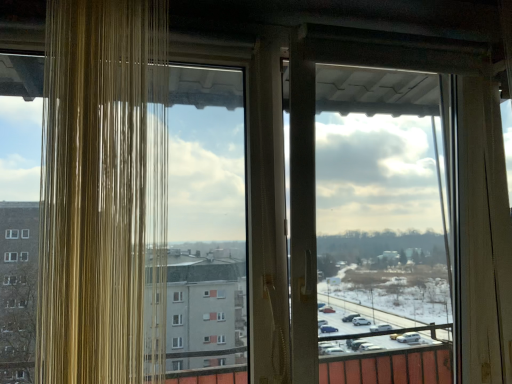
Question: Is point (400, 332) closer or farther from the camera than point (163, 142)?

Choices:
 (A) farther
 (B) closer

Answer: (A)

Question: Looking at the image, does transparent plastic screen door at center seem bigger or smaller compared to translucent glass window at left?

Choices:
 (A) small
 (B) big

Answer: (B)

Question: Considering the positions of transparent plastic screen door at center and translucent glass window at left in the image, is transparent plastic screen door at center wider or thinner than translucent glass window at left?

Choices:
 (A) wide
 (B) thin

Answer: (A)

Question: From the image's perspective, is translucent glass window at left above or below transparent plastic screen door at center?

Choices:
 (A) above
 (B) below

Answer: (A)

Question: Is point (84, 294) closer or farther from the camera than point (302, 79)?

Choices:
 (A) farther
 (B) closer

Answer: (B)

Question: In the image, is translucent glass window at left positioned in front of or behind transparent plastic screen door at center?

Choices:
 (A) behind
 (B) front

Answer: (B)

Question: From a real-world perspective, is translucent glass window at left above or below transparent plastic screen door at center?

Choices:
 (A) below
 (B) above

Answer: (B)